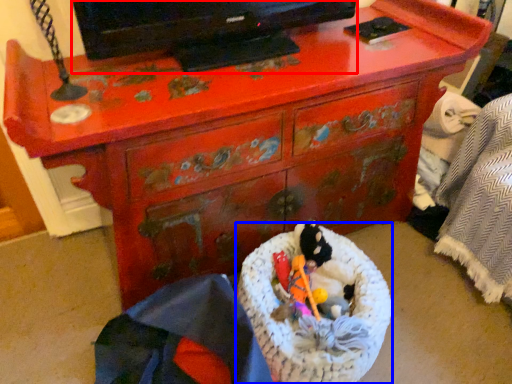
Question: Which point is closer to the camera, television (highlighted by a red box) or laundry basket (highlighted by a blue box)?

Choices:
 (A) television
 (B) laundry basket

Answer: (A)